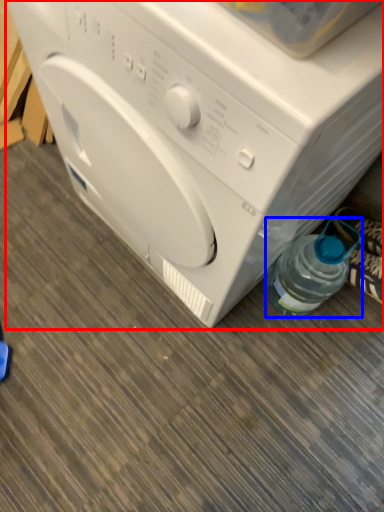
Question: Which object is further to the camera taking this photo, washing machine (highlighted by a red box) or bottle (highlighted by a blue box)?

Choices:
 (A) washing machine
 (B) bottle

Answer: (B)